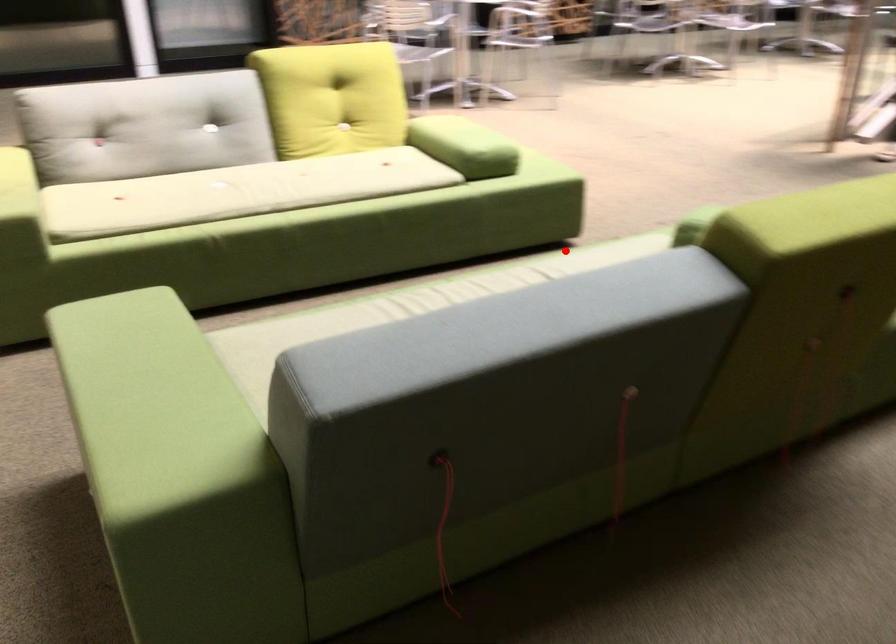
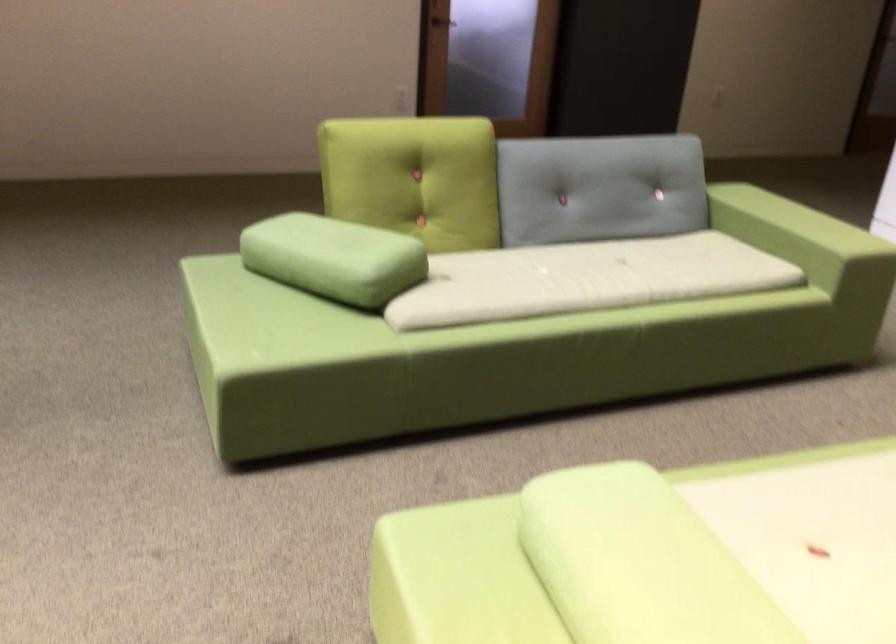
The point at the highlighted location is marked in the first image. Where is the corresponding point in the second image?

(504, 334)